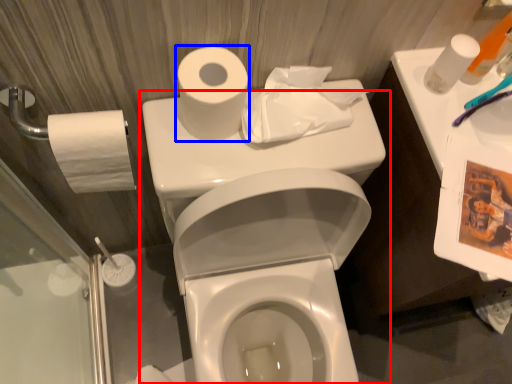
Question: Which object is further to the camera taking this photo, toilet (highlighted by a red box) or toilet paper (highlighted by a blue box)?

Choices:
 (A) toilet
 (B) toilet paper

Answer: (B)